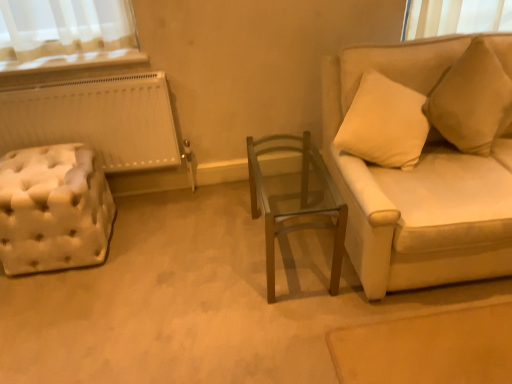
This screenshot has height=384, width=512. Find the location of `beige fabric couch at right`. beige fabric couch at right is located at coordinates (418, 183).

Describe the element at coordinates (300, 204) in the screenshot. I see `wooden glass table at center` at that location.

Locate an element on the screen. The height and width of the screenshot is (384, 512). beige fabric couch at right is located at coordinates (418, 183).

Considering the sizes of objects beige fabric pillow at upper right and beige fabric couch at right in the image provided, who is shorter, beige fabric pillow at upper right or beige fabric couch at right?

With less height is beige fabric pillow at upper right.

From a real-world perspective, is beige fabric pillow at upper right on top of beige fabric couch at right?

Yes.

Measure the distance between beige fabric pillow at upper right and beige fabric couch at right.

A distance of 10.26 inches exists between beige fabric pillow at upper right and beige fabric couch at right.

Is beige fabric pillow at upper right turned away from wooden glass table at center?

beige fabric pillow at upper right does not have its back to wooden glass table at center.

Which of these two, beige fabric pillow at upper right or wooden glass table at center, is smaller?

Smaller between the two is beige fabric pillow at upper right.

From a real-world perspective, does beige fabric pillow at upper right stand above wooden glass table at center?

Yes.

Is beige fabric pillow at upper right directly adjacent to wooden glass table at center?

No.

Is white tufted ottoman at left shorter than beige fabric couch at right?

Yes.

Is white tufted ottoman at left with beige fabric couch at right?

No, white tufted ottoman at left is not next to beige fabric couch at right.

How far apart are white tufted ottoman at left and beige fabric couch at right?

The distance of white tufted ottoman at left from beige fabric couch at right is 4.46 feet.

Could beige fabric couch at right be considered to be inside white tufted ottoman at left?

Actually, beige fabric couch at right is outside white tufted ottoman at left.

Between beige fabric pillow at upper right and white tufted ottoman at left, which one has more height?

beige fabric pillow at upper right is taller.

Does beige fabric pillow at upper right have a smaller size compared to white tufted ottoman at left?

Yes, beige fabric pillow at upper right is smaller than white tufted ottoman at left.

Measure the distance between beige fabric pillow at upper right and white tufted ottoman at left.

beige fabric pillow at upper right and white tufted ottoman at left are 1.72 meters apart.

Does point (487, 141) come closer to viewer compared to point (49, 227)?

No, it is not.

Considering the positions of objects beige fabric couch at right and white tufted ottoman at left in the image provided, who is behind, beige fabric couch at right or white tufted ottoman at left?

white tufted ottoman at left is behind.

Could you tell me if beige fabric couch at right is facing white tufted ottoman at left?

No, beige fabric couch at right is not aimed at white tufted ottoman at left.

Who is smaller, beige fabric couch at right or white tufted ottoman at left?

With smaller size is white tufted ottoman at left.

Which of these two, beige fabric couch at right or white tufted ottoman at left, is thinner?

With smaller width is white tufted ottoman at left.

Is beige fabric couch at right bigger than wooden glass table at center?

Correct, beige fabric couch at right is larger in size than wooden glass table at center.

From a real-world perspective, is beige fabric couch at right on wooden glass table at center?

Yes, from a real-world perspective, beige fabric couch at right is on top of wooden glass table at center.

Can you tell me how much beige fabric couch at right and wooden glass table at center differ in facing direction?

beige fabric couch at right and wooden glass table at center are facing 0.457 degrees away from each other.

Is white tufted ottoman at left situated inside beige fabric pillow at upper right or outside?

white tufted ottoman at left exists outside the volume of beige fabric pillow at upper right.

From a real-world perspective, does white tufted ottoman at left sit lower than beige fabric pillow at upper right?

Yes, from a real-world perspective, white tufted ottoman at left is below beige fabric pillow at upper right.

Which object is positioned more to the left, white tufted ottoman at left or beige fabric pillow at upper right?

white tufted ottoman at left.

Would you consider white tufted ottoman at left to be distant from beige fabric pillow at upper right?

Yes, white tufted ottoman at left and beige fabric pillow at upper right are quite far apart.

You are a GUI agent. You are given a task and a screenshot of the screen. Output one action in this format:
    pyautogui.click(x=<x>, y=<y>)
    Task: Click on the studio couch in front of the beige fabric pillow at upper right
    The width and height of the screenshot is (512, 384).
    Given the screenshot: What is the action you would take?
    pyautogui.click(x=418, y=183)

Identify the location of pillow on the right of wooden glass table at center. This screenshot has height=384, width=512. (472, 100).

Which object lies nearer to the anchor point wooden glass table at center, white tufted ottoman at left or beige fabric pillow at upper right?

The object closer to wooden glass table at center is beige fabric pillow at upper right.

Based on the photo, estimate the real-world distances between objects in this image. Which object is closer to white tufted ottoman at left, beige fabric pillow at upper right or wooden glass table at center?

wooden glass table at center is positioned closer to the anchor white tufted ottoman at left.

When comparing their distances from beige fabric pillow at upper right, does beige fabric couch at right or white tufted ottoman at left seem closer?

Based on the image, beige fabric couch at right appears to be nearer to beige fabric pillow at upper right.

Which object lies nearer to the anchor point beige fabric pillow at upper right, white tufted ottoman at left or beige fabric couch at right?

Based on the image, beige fabric couch at right appears to be nearer to beige fabric pillow at upper right.

When comparing their distances from beige fabric couch at right, does white tufted ottoman at left or wooden glass table at center seem closer?

Among the two, wooden glass table at center is located nearer to beige fabric couch at right.

Estimate the real-world distances between objects in this image. Which object is further from beige fabric couch at right, wooden glass table at center or beige fabric pillow at upper right?

The object further to beige fabric couch at right is wooden glass table at center.

Considering their positions, is beige fabric pillow at upper right positioned further to beige fabric couch at right than wooden glass table at center?

wooden glass table at center lies further to beige fabric couch at right than the other object.

When comparing their distances from wooden glass table at center, does beige fabric couch at right or white tufted ottoman at left seem further?

Among the two, white tufted ottoman at left is located further to wooden glass table at center.

I want to click on pillow located between white tufted ottoman at left and beige fabric couch at right in the left-right direction, so click(x=472, y=100).

The height and width of the screenshot is (384, 512). Identify the location of table located between white tufted ottoman at left and beige fabric pillow at upper right in the left-right direction. (300, 204).

This screenshot has height=384, width=512. Find the location of `table between white tufted ottoman at left and beige fabric couch at right from left to right`. table between white tufted ottoman at left and beige fabric couch at right from left to right is located at coordinates (300, 204).

Find the location of a particular element. This screenshot has width=512, height=384. pillow between wooden glass table at center and beige fabric couch at right from left to right is located at coordinates tap(472, 100).